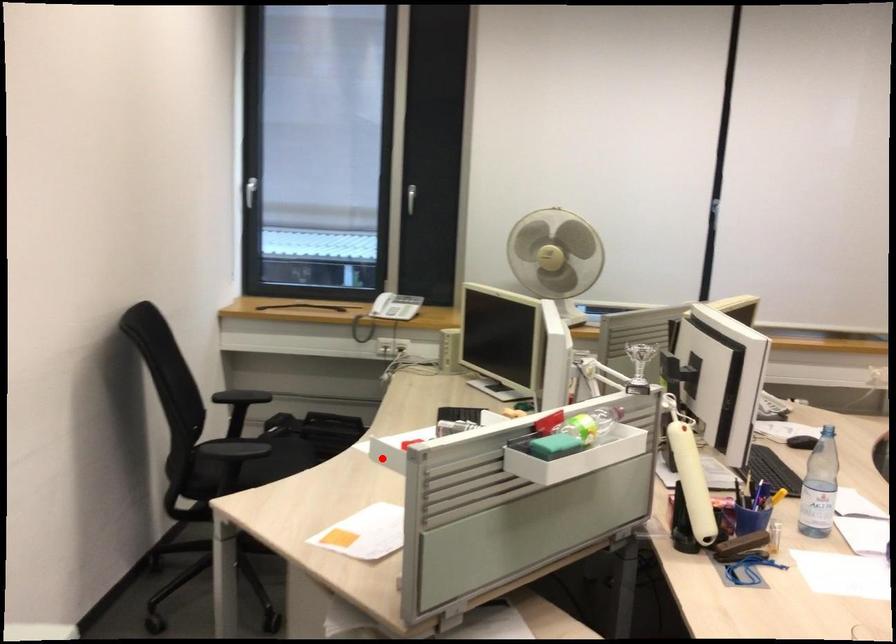
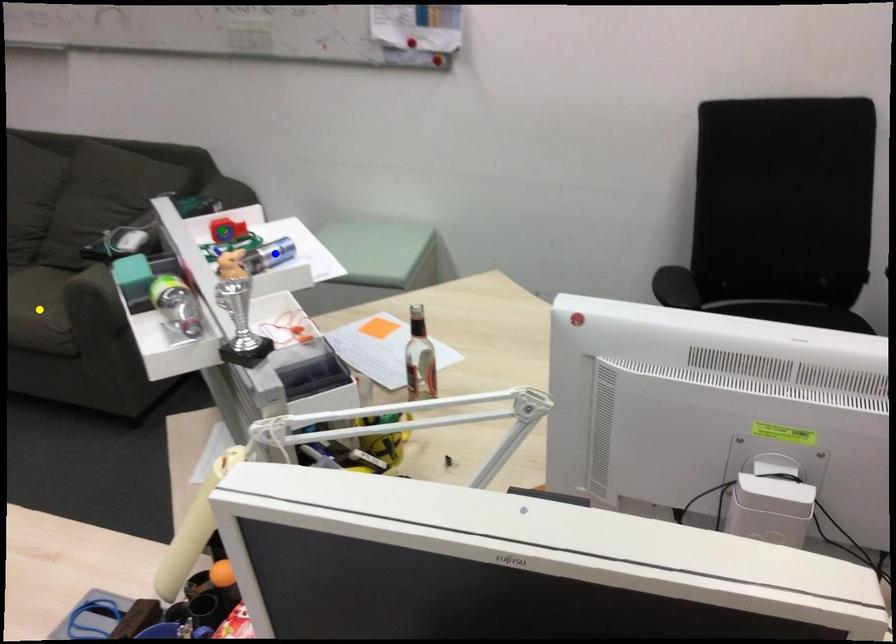
Question: I am providing you with two images of the same scene from different viewpoints. A red point is marked on the first image. You are given multiple points on the second image. In image 2, which mark is for the same physical point as the one in image 1?

Choices:
 (A) blue point
 (B) green point
 (C) yellow point

Answer: (B)